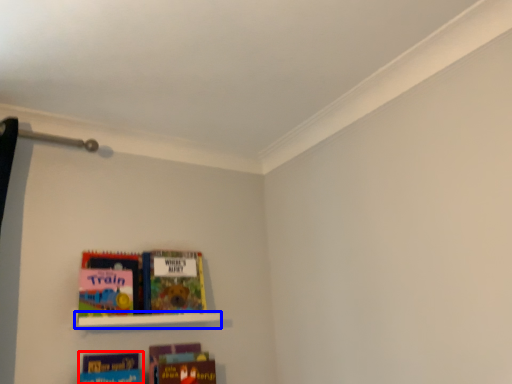
Question: Among these objects, which one is farthest to the camera, book (highlighted by a red box) or shelf (highlighted by a blue box)?

Choices:
 (A) book
 (B) shelf

Answer: (B)